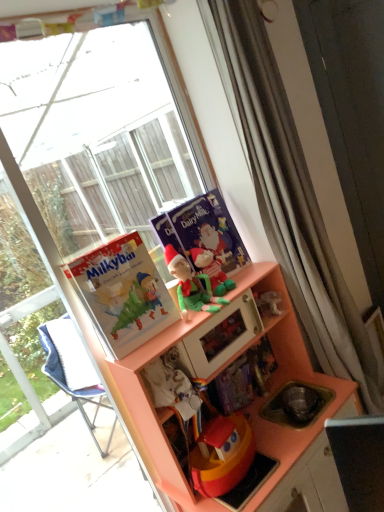
Question: From the image's perspective, is green fabric elf at upper center over transparent glass window at upper left?

Choices:
 (A) no
 (B) yes

Answer: (A)

Question: Is green fabric elf at upper center further to the viewer compared to transparent glass window at upper left?

Choices:
 (A) yes
 (B) no

Answer: (A)

Question: From a real-world perspective, is green fabric elf at upper center positioned under transparent glass window at upper left based on gravity?

Choices:
 (A) yes
 (B) no

Answer: (A)

Question: Is green fabric elf at upper center wider than transparent glass window at upper left?

Choices:
 (A) no
 (B) yes

Answer: (B)

Question: Is green fabric elf at upper center completely or partially outside of transparent glass window at upper left?

Choices:
 (A) yes
 (B) no

Answer: (A)

Question: From their relative heights in the image, would you say matte paper comic book at left, positioned as the second comic book in back-to-front order, is taller or shorter than multicolored paper book at center?

Choices:
 (A) tall
 (B) short

Answer: (A)

Question: From a real-world perspective, is matte paper comic book at left, the 1th comic book when ordered from front to back, positioned above or below multicolored paper book at center?

Choices:
 (A) below
 (B) above

Answer: (B)

Question: Do you think matte paper comic book at left, the 1th comic book when ordered from front to back, is within multicolored paper book at center, or outside of it?

Choices:
 (A) outside
 (B) inside

Answer: (A)

Question: Considering the positions of matte paper comic book at left, positioned as the second comic book in back-to-front order, and multicolored paper book at center in the image, is matte paper comic book at left, positioned as the second comic book in back-to-front order, bigger or smaller than multicolored paper book at center?

Choices:
 (A) small
 (B) big

Answer: (B)

Question: Is green plush toy at center, the second toy viewed from the front, wider or thinner than multicolored paper book at center?

Choices:
 (A) wide
 (B) thin

Answer: (A)

Question: In terms of height, does green plush toy at center, which is the first toy from back to front, look taller or shorter compared to multicolored paper book at center?

Choices:
 (A) short
 (B) tall

Answer: (B)

Question: Considering the positions of green plush toy at center, which is the first toy from back to front, and multicolored paper book at center in the image, is green plush toy at center, which is the first toy from back to front, bigger or smaller than multicolored paper book at center?

Choices:
 (A) big
 (B) small

Answer: (B)

Question: Visually, is green plush toy at center, the second toy viewed from the front, positioned to the left or to the right of multicolored paper book at center?

Choices:
 (A) right
 (B) left

Answer: (B)

Question: Is green fabric elf at upper center to the left or to the right of transparent glass window at upper left in the image?

Choices:
 (A) right
 (B) left

Answer: (A)

Question: Looking at their shapes, would you say green fabric elf at upper center is wider or thinner than transparent glass window at upper left?

Choices:
 (A) thin
 (B) wide

Answer: (B)